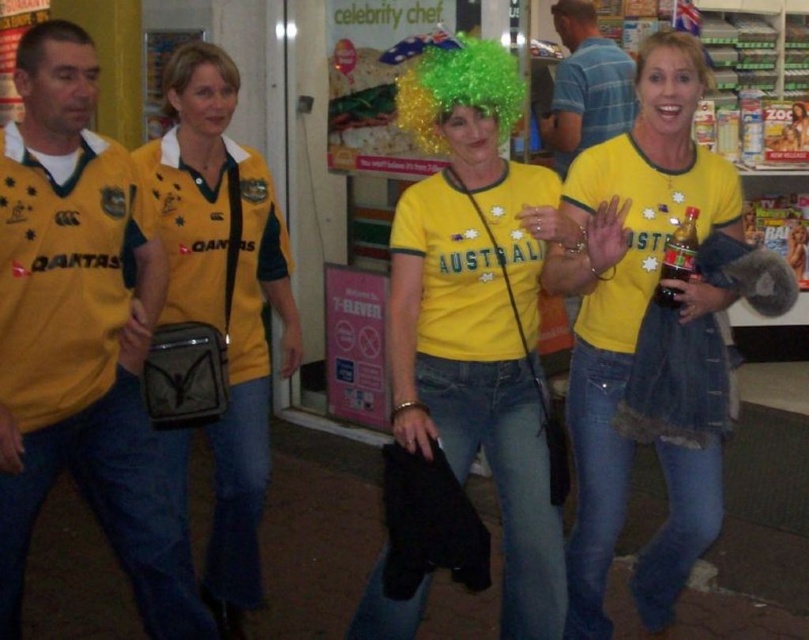
You are a photographer taking a picture of the group. You notice two points in the scene at coordinates point (164, 70) and point (28, 36). Which point should you focus on first to ensure both are in sharp focus?

You should focus on point (164, 70) first because it is closer to the camera than point (28, 36).